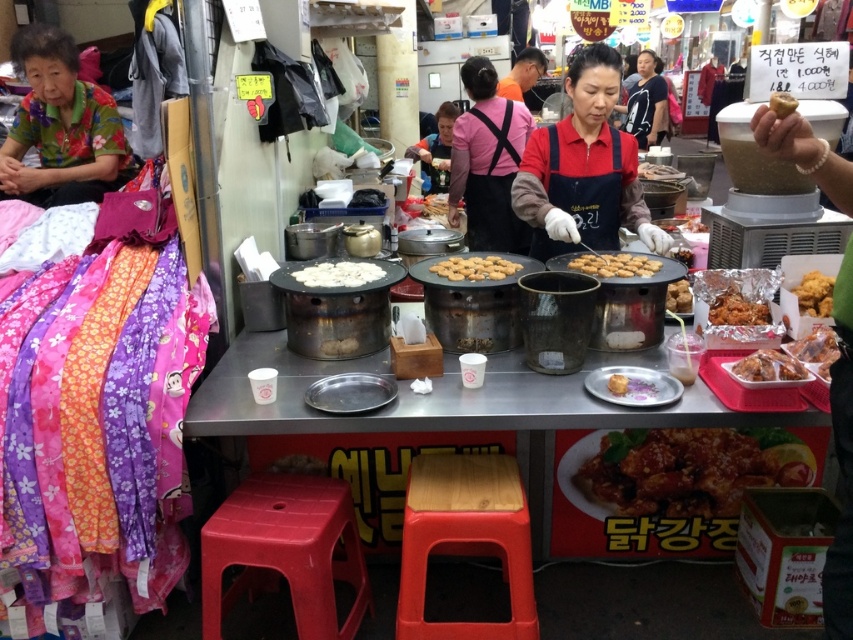
You are a customer at the food stall and want to grab your order. The vendor placed your golden crispy balls at center and your receipt in the shiny plastic bag at center right. To pick them up efficiently, which item should you reach for first?

You should reach for the golden crispy balls at center first because it is located to the left of the shiny plastic bag at center right, making it closer to your reach if you approach from the left side.